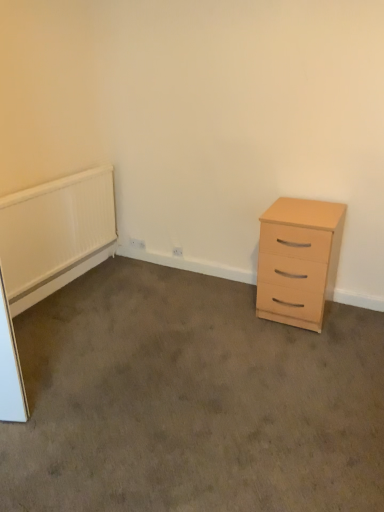
Identify the location of free region on the left part of light wood/finish chest of drawers at right. (230, 311).